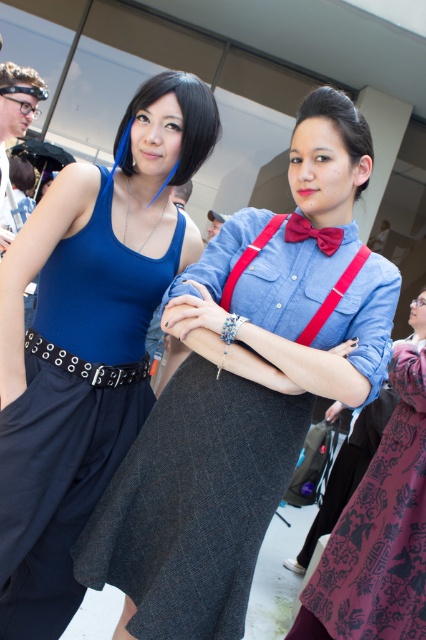
Between matte blue dress at center and smooth brown hair at center, which one has more height?

With more height is matte blue dress at center.

Who is more distant from viewer, (198, 596) or (334, 120)?

Positioned behind is point (334, 120).

At what (x,y) coordinates should I click in order to perform the action: click on matte blue dress at center. Please return your answer as a coordinate pair (x, y). This screenshot has width=426, height=640. Looking at the image, I should click on (242, 396).

Is point (313, 243) closer to viewer compared to point (333, 241)?

That is False.

Between point (273, 330) and point (333, 244), which one is positioned in front?

Point (273, 330)

Find the location of a particular element. This screenshot has width=426, height=640. matte blue dress at center is located at coordinates (242, 396).

Is smooth blue hair at center in front of shiny red bow tie at center?

No.

Which is in front, point (195, 147) or point (299, 220)?

Point (299, 220)

Image resolution: width=426 pixels, height=640 pixels. Identify the location of smooth blue hair at center. (181, 118).